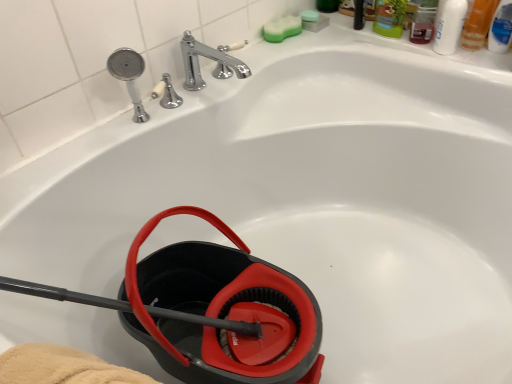
Question: Considering the positions of white glossy bottle at upper right, acting as the third mouthwash starting from the right, and translucent plastic mouthwash at upper right, the second mouthwash when ordered from left to right, in the image, is white glossy bottle at upper right, acting as the third mouthwash starting from the right, taller or shorter than translucent plastic mouthwash at upper right, the second mouthwash when ordered from left to right,?

Choices:
 (A) tall
 (B) short

Answer: (B)

Question: Based on their positions, is white glossy bottle at upper right, the 1th mouthwash viewed from the left, located to the left or right of translucent plastic mouthwash at upper right, which is the second mouthwash in right-to-left order?

Choices:
 (A) left
 (B) right

Answer: (A)

Question: Which is nearer to the white glossy bottle at upper right, the 1th mouthwash viewed from the left?

Choices:
 (A) green sponge at upper right, which is counted as the 2th soap, starting from the right
 (B) green sponge at upper center, which ranks as the 1th soap in right-to-left order
 (C) translucent plastic mouthwash at upper right, the second mouthwash when ordered from left to right
 (D) black rubber garden hose at lower left
 (E) blue plastic mouthwash at upper right, placed as the third mouthwash when sorted from left to right

Answer: (C)

Question: Estimate the real-world distances between objects in this image. Which object is farther from the blue plastic mouthwash at upper right, arranged as the first mouthwash when viewed from the right?

Choices:
 (A) green sponge at upper right, positioned as the 1th soap in left-to-right order
 (B) chrome metallic faucet at upper center
 (C) translucent plastic mouthwash at upper right, which is the second mouthwash in right-to-left order
 (D) green sponge at upper center, which ranks as the 1th soap in right-to-left order
 (E) black rubber garden hose at lower left

Answer: (E)